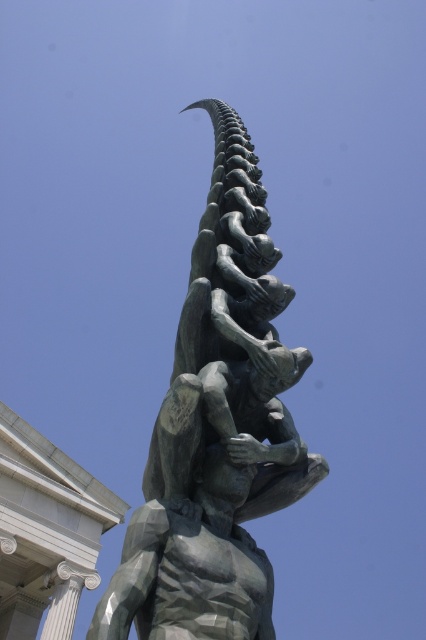
Question: Is bronze textured sculpture at center above polished bronze statue at center?

Choices:
 (A) no
 (B) yes

Answer: (B)

Question: Can you confirm if bronze textured sculpture at center is smaller than polished bronze statue at center?

Choices:
 (A) yes
 (B) no

Answer: (B)

Question: From the image, what is the correct spatial relationship of bronze textured sculpture at center in relation to polished bronze statue at center?

Choices:
 (A) below
 (B) above

Answer: (B)

Question: Which of the following is the farthest from the observer?

Choices:
 (A) (247, 481)
 (B) (212, 244)

Answer: (B)

Question: Among these objects, which one is farthest from the camera?

Choices:
 (A) bronze textured sculpture at center
 (B) polished bronze statue at center

Answer: (A)